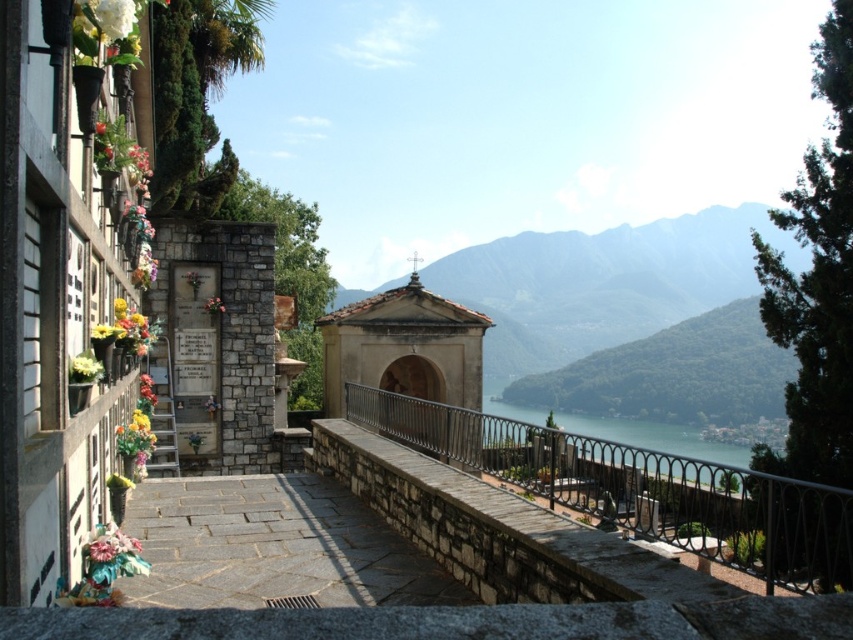
Question: Which object is closer to the camera taking this photo?

Choices:
 (A) greenish-blue water at center
 (B) black wrought iron railing at center
 (C) gray stone path at center
 (D) green textured mountain at center

Answer: (B)

Question: Which point appears farthest from the camera in this image?

Choices:
 (A) (798, 582)
 (B) (316, 499)
 (C) (440, 268)
 (D) (590, 433)

Answer: (C)

Question: Among these objects, which one is nearest to the camera?

Choices:
 (A) green textured mountain at center
 (B) black wrought iron railing at center
 (C) gray stone path at center
 (D) greenish-blue water at center

Answer: (B)

Question: Is gray stone path at center bigger than greenish-blue water at center?

Choices:
 (A) yes
 (B) no

Answer: (B)

Question: Does black wrought iron railing at center have a lesser width compared to greenish-blue water at center?

Choices:
 (A) yes
 (B) no

Answer: (A)

Question: Where is gray stone path at center located in relation to greenish-blue water at center in the image?

Choices:
 (A) above
 (B) below

Answer: (A)